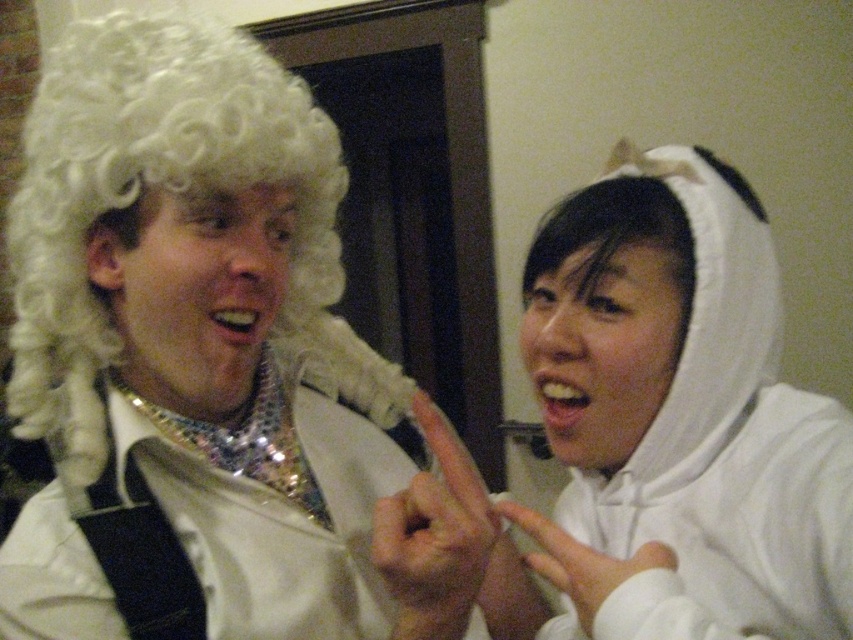
You are standing in front of the image and want to place a small sticker exactly at the center of the white plush hoodie at upper right. According to the coordinates provided, where should you place the sticker?

The sticker should be placed at the coordinates point (677, 417) as the white plush hoodie at upper right is located there.

Please provide the coordinates of the white plush hoodie at upper right in the image. The coordinates should be in the format of a point with two decimal places, such as point (677,417). The scene shows two costumed individuals, one on the left with a white wig and sequined collar, and the other on the right in a white hoodie with a black and white patterned back. You must mention both individuals in your question.

The white plush hoodie at upper right is represented by point (677,417).

You are at a costume party and want to take a photo with both the white plush hoodie at upper right and the shiny sequined robe at left. Since you can only focus on one person at a time, which one should you aim the camera at first to ensure both are in the frame?

You should aim the camera at the shiny sequined robe at left first because the white plush hoodie at upper right is located above it, so adjusting focus from the lower to upper position will capture both in the frame.